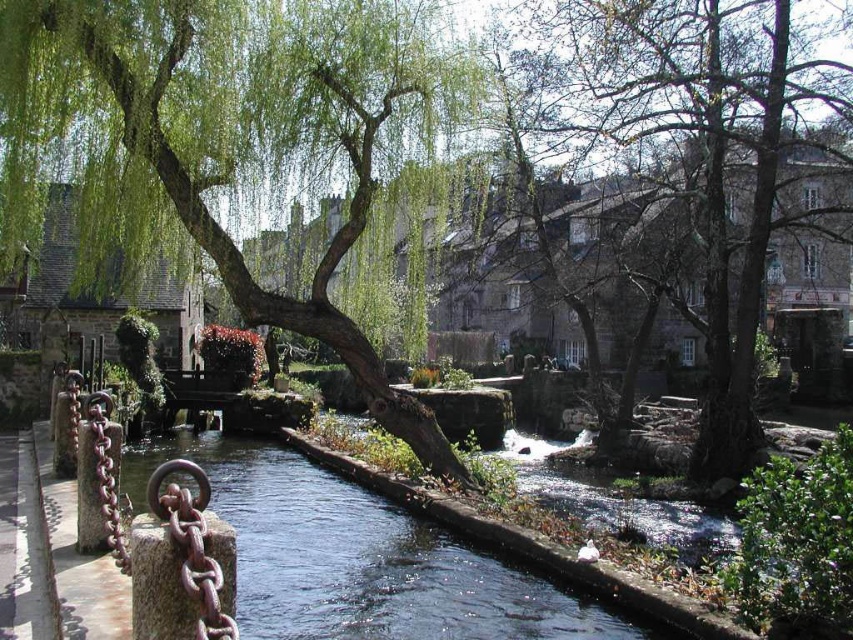
Question: Can you confirm if smooth bark tree at center is smaller than clear water at center?

Choices:
 (A) yes
 (B) no

Answer: (B)

Question: Can you confirm if green leafy willow at center is smaller than smooth bark tree at center?

Choices:
 (A) no
 (B) yes

Answer: (B)

Question: Does smooth bark tree at center have a greater width compared to clear water at center?

Choices:
 (A) no
 (B) yes

Answer: (B)

Question: Which object is farther from the camera taking this photo?

Choices:
 (A) clear water at center
 (B) green leafy willow at center

Answer: (B)

Question: Which point appears farthest from the camera in this image?

Choices:
 (A) (515, 627)
 (B) (691, 120)

Answer: (B)

Question: Among these objects, which one is nearest to the camera?

Choices:
 (A) green leafy willow at center
 (B) smooth bark tree at center
 (C) clear water at center

Answer: (C)